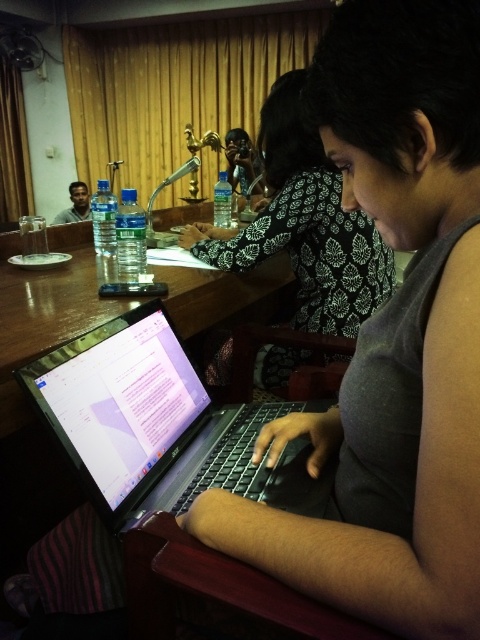
Question: Is black printed blouse at center positioned before wooden table at center?

Choices:
 (A) no
 (B) yes

Answer: (A)

Question: Which object is farther from the camera taking this photo?

Choices:
 (A) wooden table at center
 (B) matte black laptop at left

Answer: (B)

Question: Which point is farther from the camera taking this photo?

Choices:
 (A) (67, 211)
 (B) (294, 268)

Answer: (A)

Question: Which of the following is the farthest from the observer?

Choices:
 (A) wooden table at center
 (B) black printed blouse at center
 (C) black glossy laptop at center
 (D) matte black laptop at left

Answer: (D)

Question: Is wooden table at center to the right of matte black laptop at left from the viewer's perspective?

Choices:
 (A) no
 (B) yes

Answer: (B)

Question: From the image, what is the correct spatial relationship of wooden table at center in relation to matte black laptop at left?

Choices:
 (A) below
 (B) above

Answer: (A)